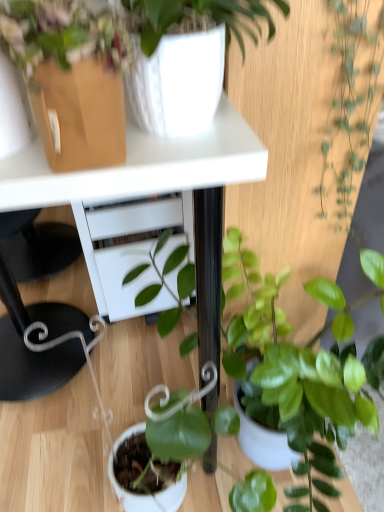
Question: From the image's perspective, is green glossy plant at right, which is the first houseplant in top-to-bottom order, positioned above or below green glossy plant at center, which is counted as the 3th houseplant, starting from the top?

Choices:
 (A) above
 (B) below

Answer: (A)

Question: Considering the positions of green glossy plant at right, the 3th houseplant in the bottom-to-top sequence, and green glossy plant at center, which is counted as the 3th houseplant, starting from the top, in the image, is green glossy plant at right, the 3th houseplant in the bottom-to-top sequence, bigger or smaller than green glossy plant at center, which is counted as the 3th houseplant, starting from the top,?

Choices:
 (A) small
 (B) big

Answer: (A)

Question: Based on their relative distances, which object is farther from the white glossy vase at upper center, which ranks as the 2th houseplant in bottom-to-top order?

Choices:
 (A) green glossy plant at center, which is counted as the 3th houseplant, starting from the top
 (B) white glossy table at upper center
 (C) green glossy plant at right, the 3th houseplant in the bottom-to-top sequence

Answer: (A)

Question: Based on their relative distances, which object is nearer to the white glossy table at upper center?

Choices:
 (A) green glossy plant at right, the 3th houseplant in the bottom-to-top sequence
 (B) green glossy plant at center, which is counted as the 3th houseplant, starting from the top
 (C) white glossy vase at upper center, positioned as the second houseplant in top-to-bottom order

Answer: (C)